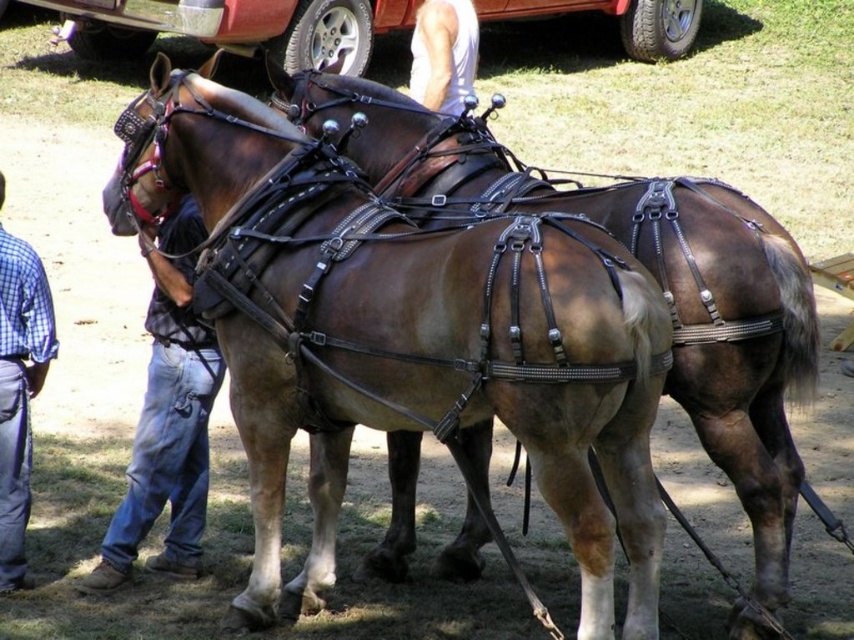
Question: Which of the following is the farthest from the observer?

Choices:
 (A) (254, 525)
 (B) (104, 550)
 (C) (457, 106)
 (D) (104, 33)

Answer: (D)

Question: Which point is farther to the camera?

Choices:
 (A) brushed metal car at upper center
 (B) brown leather harness at center

Answer: (A)

Question: Can you confirm if blue plaid shirt at left is wider than white tank top at upper center?

Choices:
 (A) yes
 (B) no

Answer: (B)

Question: Is brushed metal car at upper center bigger than white tank top at upper center?

Choices:
 (A) yes
 (B) no

Answer: (A)

Question: Does blue jeans at left have a lesser width compared to white tank top at upper center?

Choices:
 (A) no
 (B) yes

Answer: (A)

Question: Which object appears closest to the camera in this image?

Choices:
 (A) brown leather harness at center
 (B) blue jeans at left
 (C) brushed metal car at upper center
 (D) blue plaid shirt at left

Answer: (A)